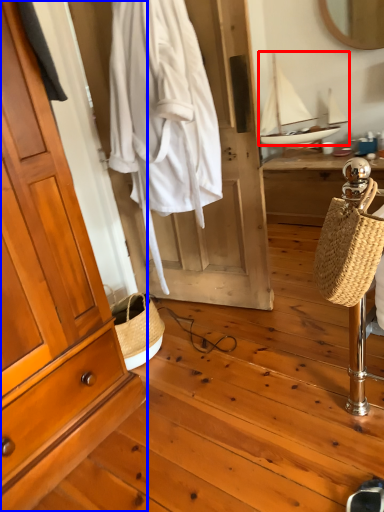
Question: Which object appears farthest to the camera in this image, sailboat (highlighted by a red box) or cabinetry (highlighted by a blue box)?

Choices:
 (A) sailboat
 (B) cabinetry

Answer: (A)